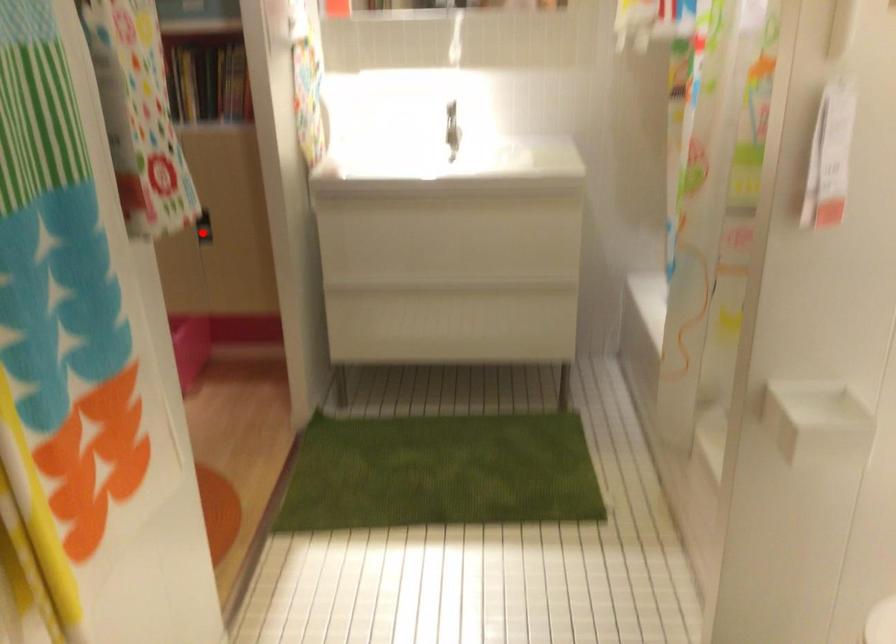
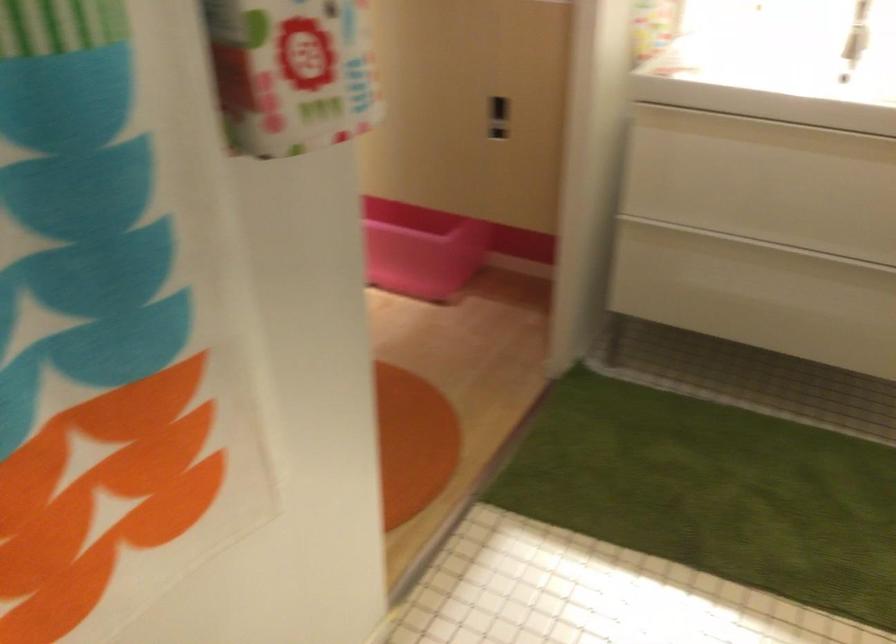
The point at the highlighted location is marked in the first image. Where is the corresponding point in the second image?

(497, 118)